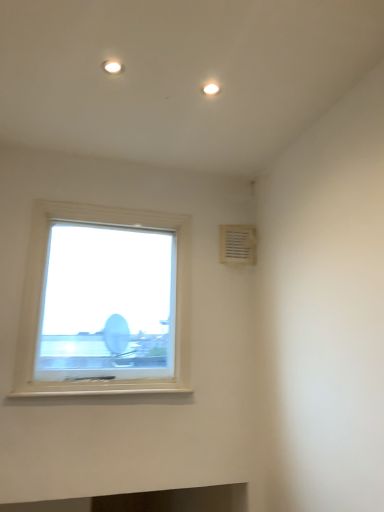
Question: Would you say white plastic vent at upper right is inside or outside white plastic window at upper left?

Choices:
 (A) outside
 (B) inside

Answer: (A)

Question: Considering the positions of white plastic vent at upper right and white plastic window at upper left in the image, is white plastic vent at upper right taller or shorter than white plastic window at upper left?

Choices:
 (A) tall
 (B) short

Answer: (B)

Question: Is point (226, 239) positioned closer to the camera than point (71, 280)?

Choices:
 (A) farther
 (B) closer

Answer: (A)

Question: Would you say white plastic window at upper left is inside or outside white plastic vent at upper right?

Choices:
 (A) inside
 (B) outside

Answer: (B)

Question: Considering the positions of point (102, 263) and point (248, 240), is point (102, 263) closer or farther from the camera than point (248, 240)?

Choices:
 (A) closer
 (B) farther

Answer: (A)

Question: From the image's perspective, is white plastic window at upper left located above or below white plastic vent at upper right?

Choices:
 (A) below
 (B) above

Answer: (A)

Question: In the image, is white plastic window at upper left positioned in front of or behind white plastic vent at upper right?

Choices:
 (A) front
 (B) behind

Answer: (A)